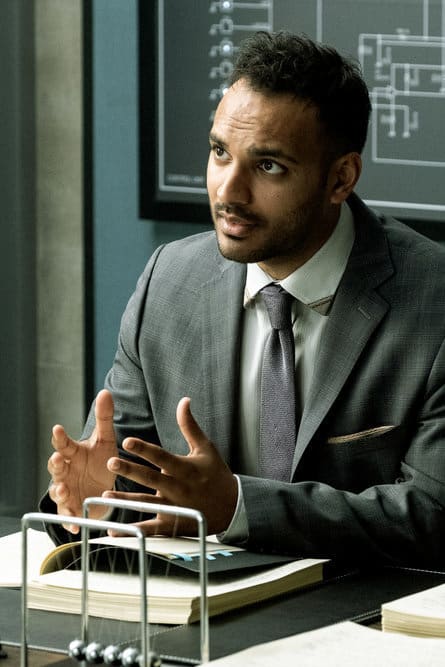
The height and width of the screenshot is (667, 445). Identify the location of papers. (366, 643), (420, 594).